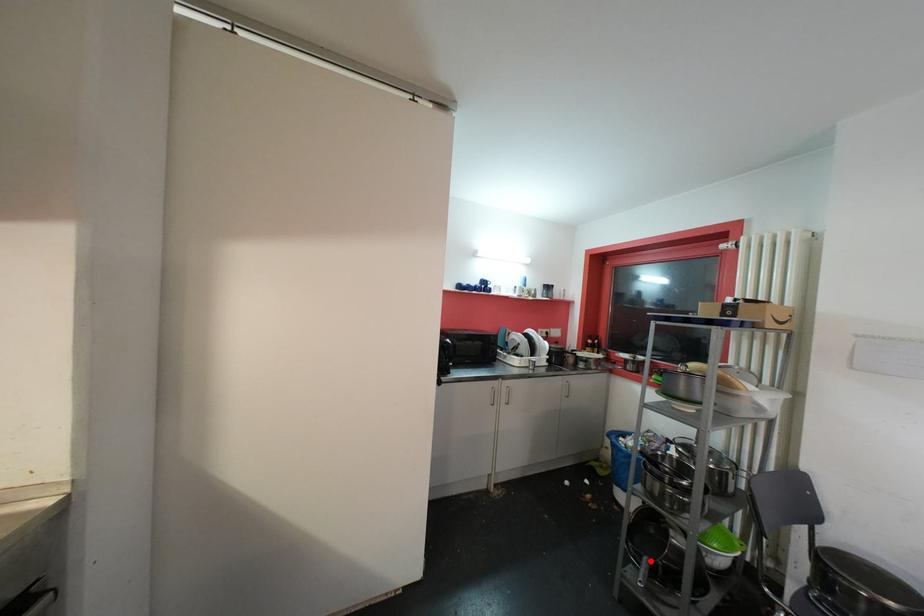
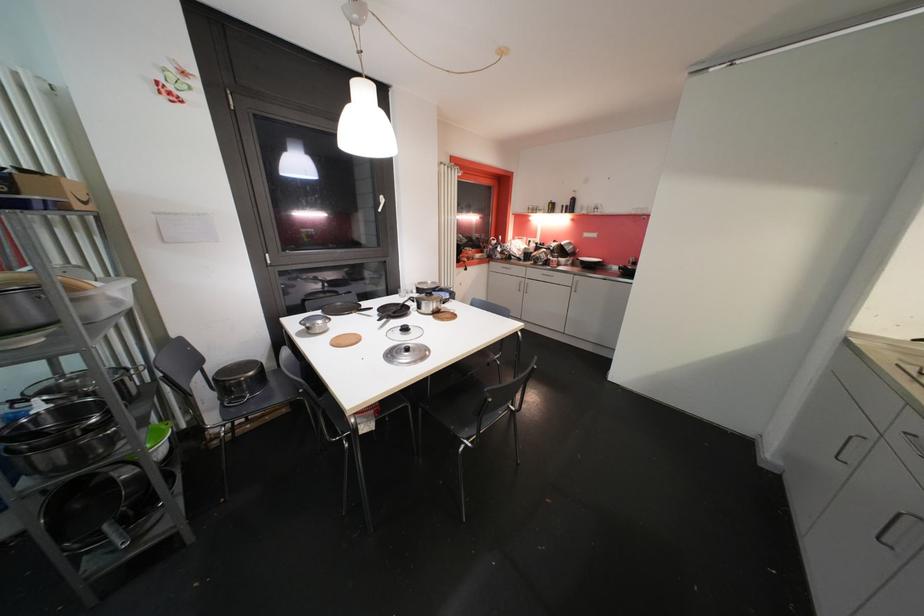
Find the pixel in the second image that matches the highlighted location in the first image.

(111, 529)